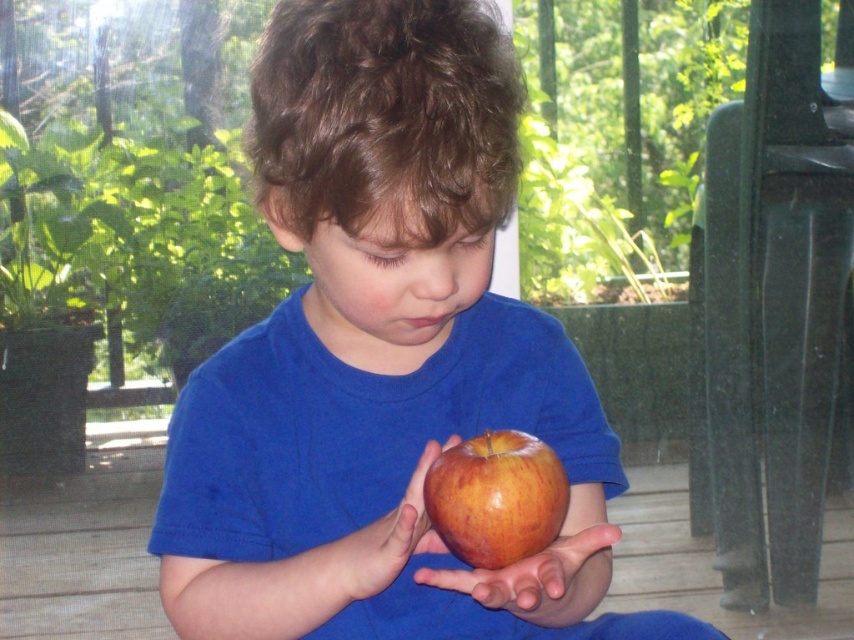
Question: Is matte red apple at center thinner than glossy apple at center?

Choices:
 (A) no
 (B) yes

Answer: (A)

Question: Which of these objects is positioned farthest from the smooth skin palm at center?

Choices:
 (A) matte red apple at center
 (B) shiny red apple at center

Answer: (A)

Question: Does matte red apple at center lie in front of shiny red apple at center?

Choices:
 (A) no
 (B) yes

Answer: (B)

Question: Which of the following is the farthest from the observer?

Choices:
 (A) smooth skin palm at center
 (B) glossy apple at center
 (C) shiny red apple at center

Answer: (C)

Question: Among these objects, which one is farthest from the camera?

Choices:
 (A) smooth skin palm at center
 (B) shiny red apple at center
 (C) glossy apple at center

Answer: (B)

Question: Can you confirm if shiny red apple at center is bigger than glossy apple at center?

Choices:
 (A) yes
 (B) no

Answer: (B)